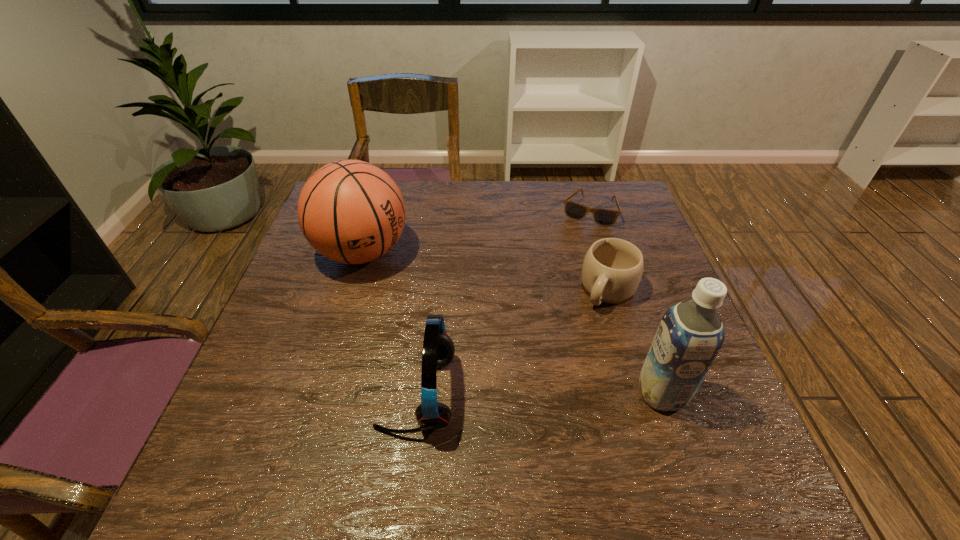
This screenshot has height=540, width=960. I want to click on free spot between the sunglasses and the basketball, so click(475, 232).

In order to click on vacant area between the basketball and the third shortest object in this screenshot , I will do `click(390, 323)`.

This screenshot has height=540, width=960. What are the coordinates of `vacant space that's between the basketball and the sunglasses` in the screenshot? It's located at (475, 232).

The width and height of the screenshot is (960, 540). Find the location of `empty space between the headset and the mug`. empty space between the headset and the mug is located at coordinates (513, 342).

The image size is (960, 540). In order to click on vacant space in between the third shortest object and the shortest object in this screenshot , I will do `click(503, 302)`.

Identify the location of free space between the mug and the third shortest object. The image size is (960, 540). (513, 342).

You are a GUI agent. You are given a task and a screenshot of the screen. Output one action in this format:
    pyautogui.click(x=<x>, y=<y>)
    Task: Click on the blank region between the fourth tallest object and the basketball
    
    Given the screenshot: What is the action you would take?
    pyautogui.click(x=486, y=271)

Locate which object is the closest to the headset. Please provide its 2D coordinates. Your answer should be formatted as a tuple, i.e. [(x, y)], where the tuple contains the x and y coordinates of a point satisfying the conditions above.

[(350, 211)]

Where is `object that stands as the fourth closest to the basketball`? The height and width of the screenshot is (540, 960). object that stands as the fourth closest to the basketball is located at coordinates (690, 335).

Locate an element on the screen. blank space that satisfies the following two spatial constraints: 1. on the back side of the second shortest object; 2. on the left side of the shortest object is located at coordinates (585, 211).